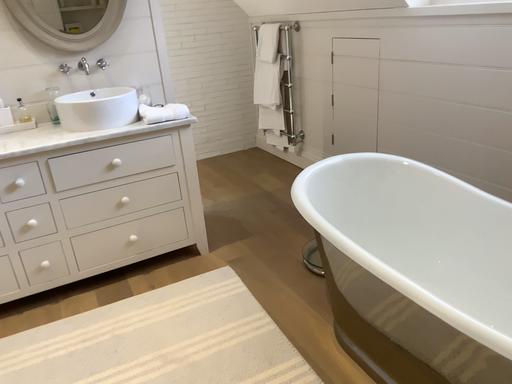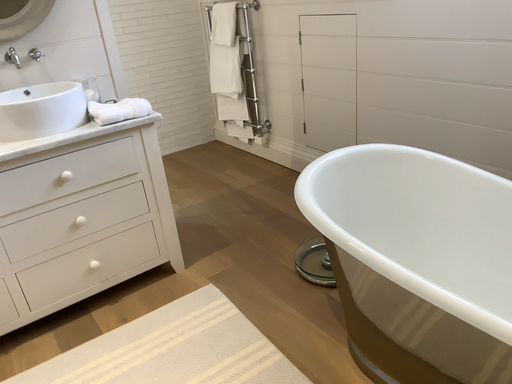
Question: How did the camera likely rotate when shooting the video?

Choices:
 (A) rotated left
 (B) rotated right

Answer: (B)